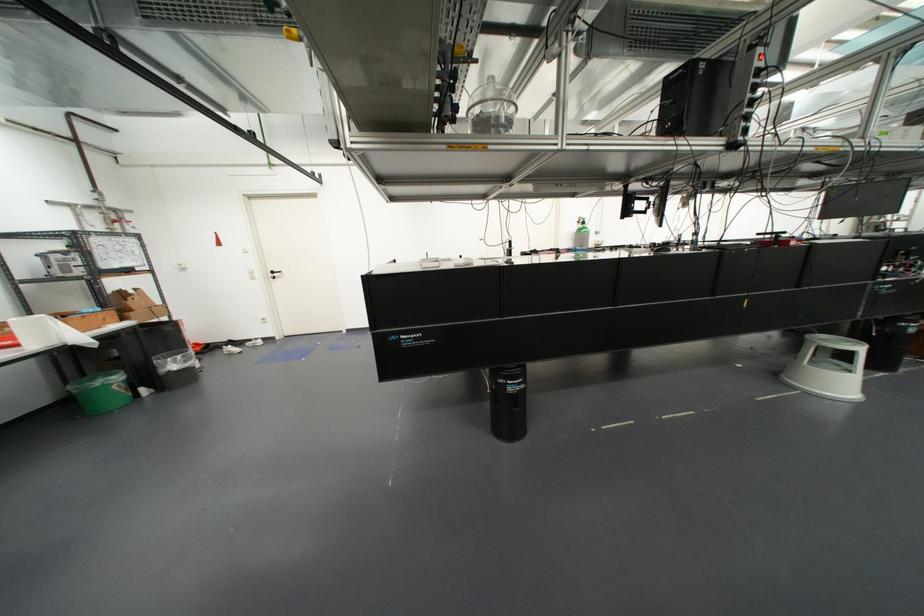
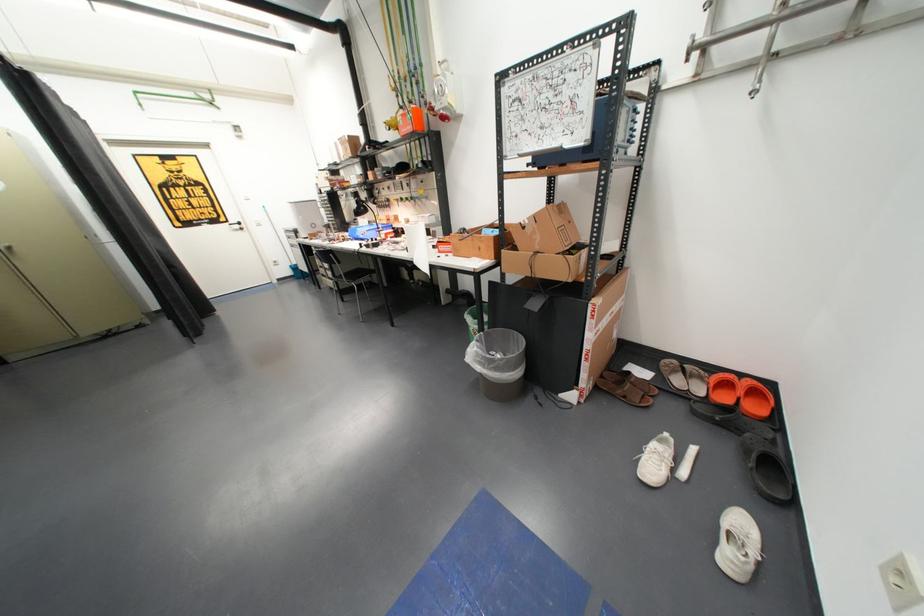
Find the pixel in the second image that matches the point at 166,328 in the first image.

(535, 304)